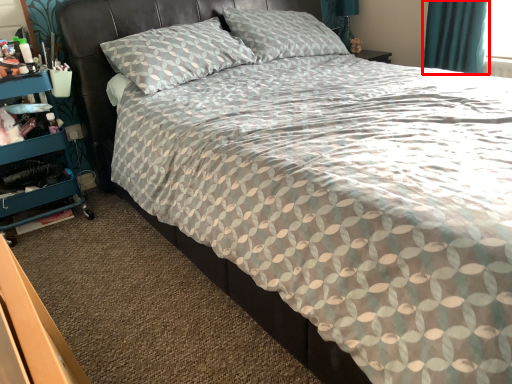
Question: From the image's perspective, where is curtain (annotated by the red box) located relative to dresser?

Choices:
 (A) above
 (B) below

Answer: (A)